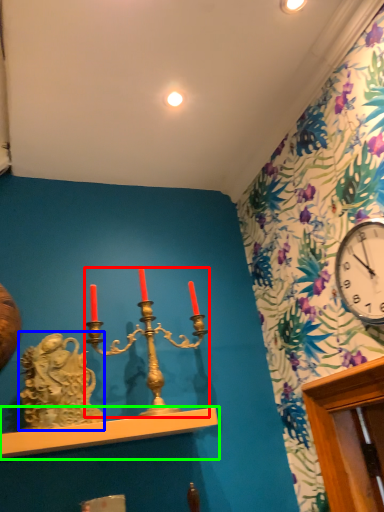
Question: Considering the real-world distances, which object is closest to candle holder (highlighted by a red box)? sculpture (highlighted by a blue box) or shelf (highlighted by a green box).

Choices:
 (A) sculpture
 (B) shelf

Answer: (B)